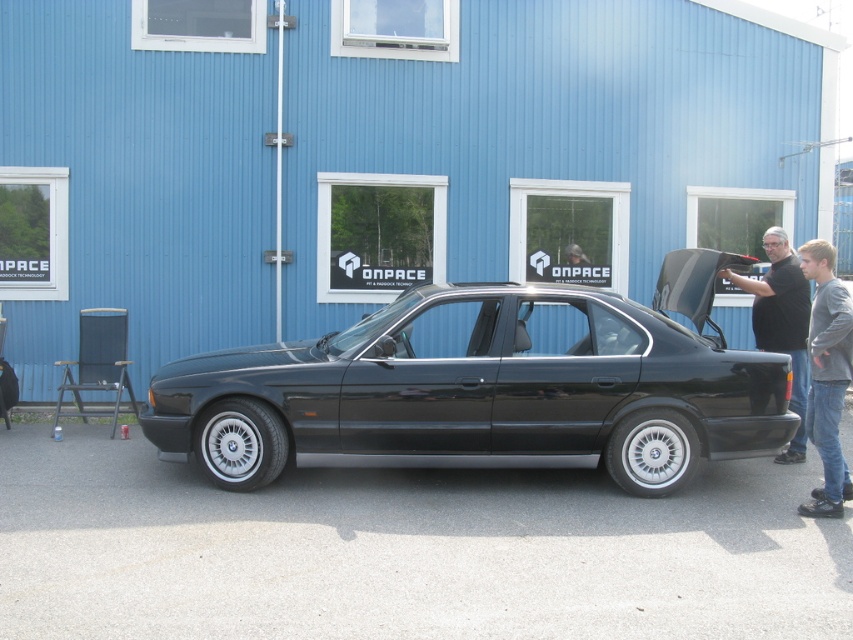
Looking at this image, you are a customer waiting to get into the car. You see the gray cotton sweater at lower right and the black matte shirt at right. Which person should you approach to ask for assistance?

The gray cotton sweater at lower right is positioned on the left side of black matte shirt at right, so you should approach the person wearing the black matte shirt at right as they are closer to the car entrance.

Where is the black metallic car at center located in the image?

The black metallic car at center is located at point (486, 387).